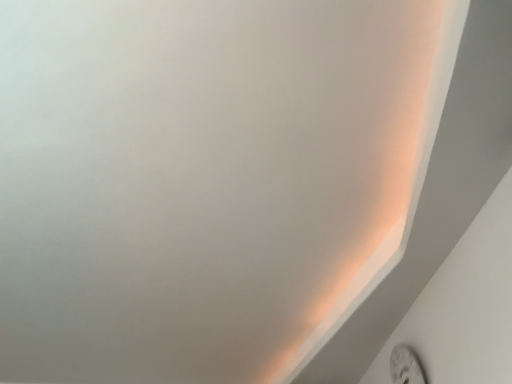
Describe the element at coordinates (406, 366) in the screenshot. This screenshot has width=512, height=384. I see `white plastic clock at lower right` at that location.

Locate an element on the screen. The image size is (512, 384). white plastic clock at lower right is located at coordinates point(406,366).

You are a GUI agent. You are given a task and a screenshot of the screen. Output one action in this format:
    pyautogui.click(x=<x>, y=<y>)
    Task: Click on the white plastic clock at lower right
    The image size is (512, 384).
    Given the screenshot: What is the action you would take?
    pyautogui.click(x=406, y=366)